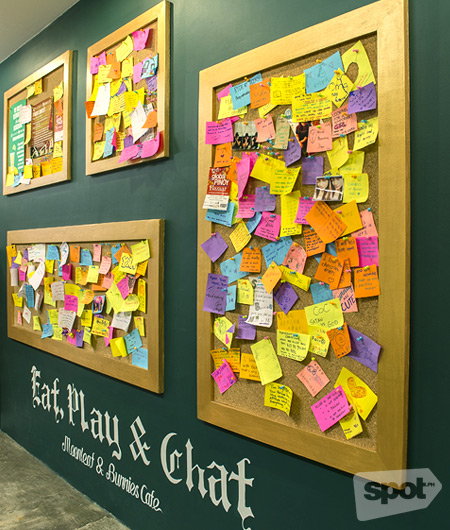
Identify the location of push pin. (335, 70), (365, 268), (265, 338), (244, 314), (226, 346).